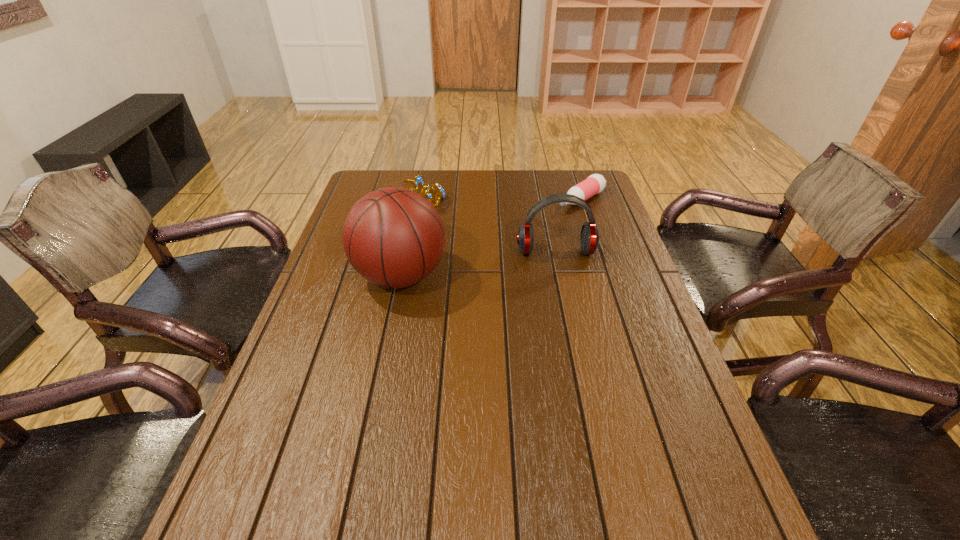
At what (x,y) coordinates should I click in order to perform the action: click on vacant space that is in between the basketball and the bottle. Please return your answer as a coordinate pair (x, y). Image resolution: width=960 pixels, height=540 pixels. Looking at the image, I should click on (492, 238).

You are a GUI agent. You are given a task and a screenshot of the screen. Output one action in this format:
    pyautogui.click(x=<x>, y=<y>)
    Task: Click on the free spot between the bottle and the earphone
    Image resolution: width=960 pixels, height=540 pixels.
    Given the screenshot: What is the action you would take?
    pyautogui.click(x=568, y=226)

The height and width of the screenshot is (540, 960). In order to click on empty space between the shortest object and the basketball in this screenshot , I will do `click(492, 238)`.

At what (x,y) coordinates should I click in order to perform the action: click on free space between the bottle and the third tallest object. Please return your answer as a coordinate pair (x, y). Looking at the image, I should click on pyautogui.click(x=496, y=199).

Locate which object is the third closest to the tiara. Please provide its 2D coordinates. Your answer should be formatted as a tuple, i.e. [(x, y)], where the tuple contains the x and y coordinates of a point satisfying the conditions above.

[(595, 183)]

Identify which object is the closest to the earphone. Please provide its 2D coordinates. Your answer should be formatted as a tuple, i.e. [(x, y)], where the tuple contains the x and y coordinates of a point satisfying the conditions above.

[(595, 183)]